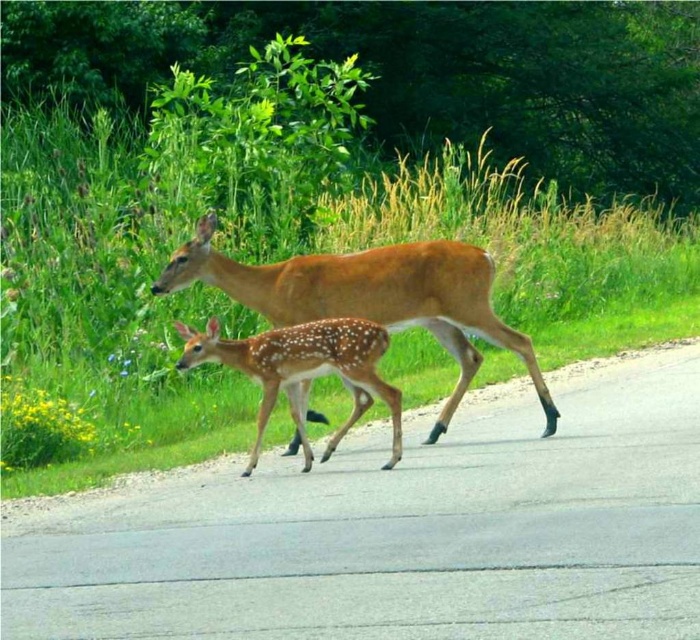
Question: Is brown speckled deer at center further to camera compared to fawn-patterned deer at center?

Choices:
 (A) yes
 (B) no

Answer: (A)

Question: Is brown speckled deer at center closer to camera compared to fawn-patterned deer at center?

Choices:
 (A) no
 (B) yes

Answer: (A)

Question: Is brown speckled deer at center closer to camera compared to fawn-patterned deer at center?

Choices:
 (A) yes
 (B) no

Answer: (B)

Question: Among these points, which one is nearest to the camera?

Choices:
 (A) (295, 400)
 (B) (461, 308)

Answer: (A)